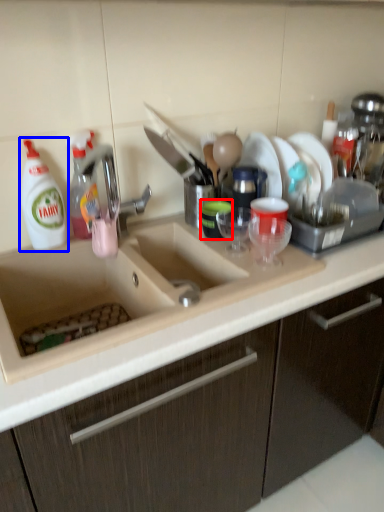
Question: Among these objects, which one is nearest to the camera, tableware (highlighted by a red box) or cleaning product (highlighted by a blue box)?

Choices:
 (A) tableware
 (B) cleaning product

Answer: (B)